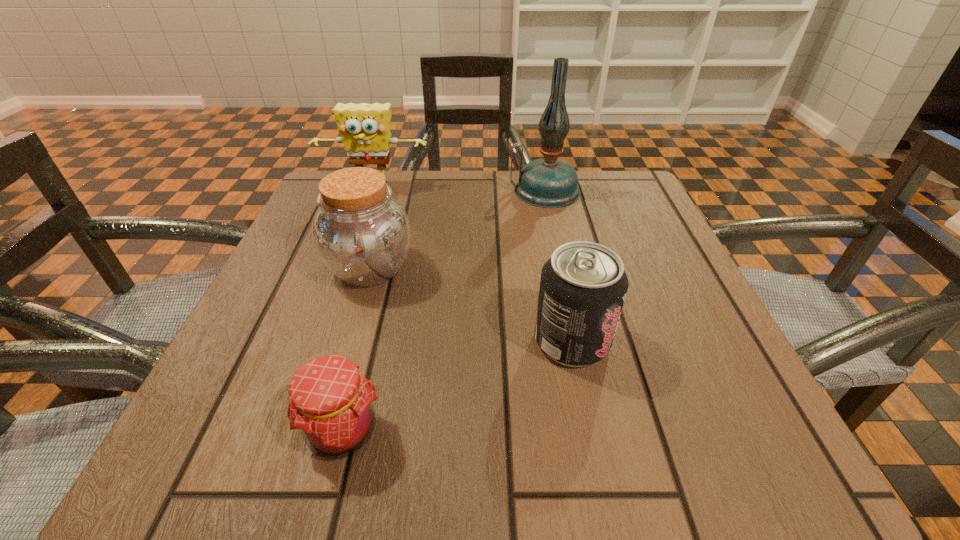
You are a GUI agent. You are given a task and a screenshot of the screen. Output one action in this format:
    pyautogui.click(x=<x>, y=<y>)
    Task: Click on the oil lamp
    The image size is (960, 540).
    Given the screenshot: What is the action you would take?
    pyautogui.click(x=548, y=182)

Locate an element on the screen. This screenshot has height=540, width=960. sponge is located at coordinates (365, 128).

Locate an element on the screen. This screenshot has width=960, height=540. jar is located at coordinates (361, 233).

Find the location of a particular element. the fourth farthest object is located at coordinates (583, 286).

Where is `jam`? This screenshot has width=960, height=540. jam is located at coordinates (331, 406).

This screenshot has height=540, width=960. Identify the location of the shortest object. (331, 406).

In order to click on vacant space located on the front of the oil lamp in this screenshot , I will do `click(564, 281)`.

The width and height of the screenshot is (960, 540). Find the location of `blank space located 0.150m on the face of the sponge`. blank space located 0.150m on the face of the sponge is located at coordinates (357, 236).

This screenshot has height=540, width=960. In order to click on free space located 0.080m on the front of the jar in this screenshot , I will do `click(350, 335)`.

You are a GUI agent. You are given a task and a screenshot of the screen. Output one action in this format:
    pyautogui.click(x=<x>, y=<y>)
    Task: Click on the vacant space located 0.360m on the left of the second nearest object
    
    Given the screenshot: What is the action you would take?
    pyautogui.click(x=299, y=341)